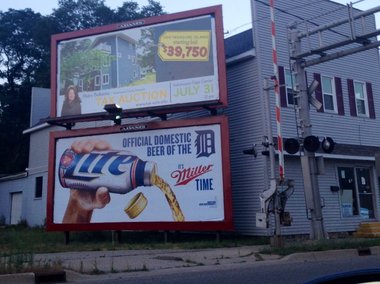
This screenshot has width=380, height=284. What are the coordinates of `bottle` in the screenshot? It's located at (101, 167).